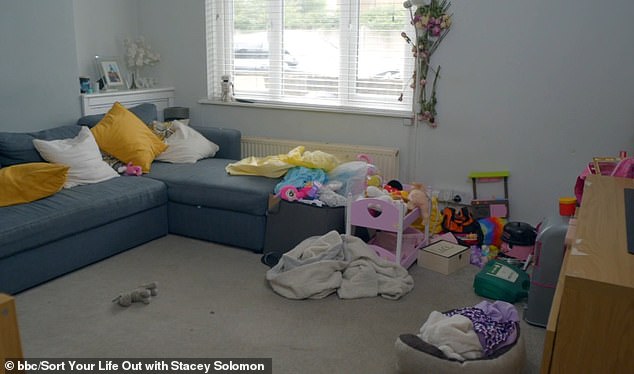
Find the location of a particular element. This screenshot has width=634, height=374. blankets is located at coordinates (347, 279), (274, 165).